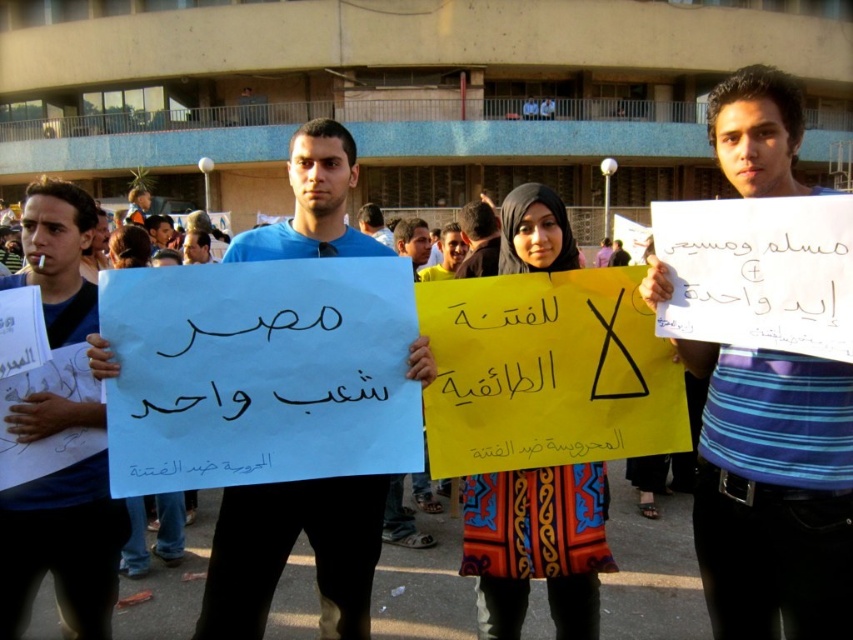
Question: Which of the following is the closest to the observer?

Choices:
 (A) (383, 237)
 (B) (286, 524)
 (C) (73, 484)

Answer: (B)

Question: Estimate the real-world distances between objects in this image. Which object is farther from the blue paper at left?

Choices:
 (A) matte blue shirt at center
 (B) blue striped shirt at center
 (C) blue paper sign at center

Answer: (A)

Question: Does blue paper at left have a greater width compared to matte blue shirt at center?

Choices:
 (A) yes
 (B) no

Answer: (B)

Question: Is blue striped shirt at center positioned behind blue paper sign at center?

Choices:
 (A) yes
 (B) no

Answer: (B)

Question: Which object is farther from the camera taking this photo?

Choices:
 (A) blue striped shirt at center
 (B) blue paper at left

Answer: (B)

Question: Is the position of blue paper sign at center less distant than that of blue paper at left?

Choices:
 (A) no
 (B) yes

Answer: (B)